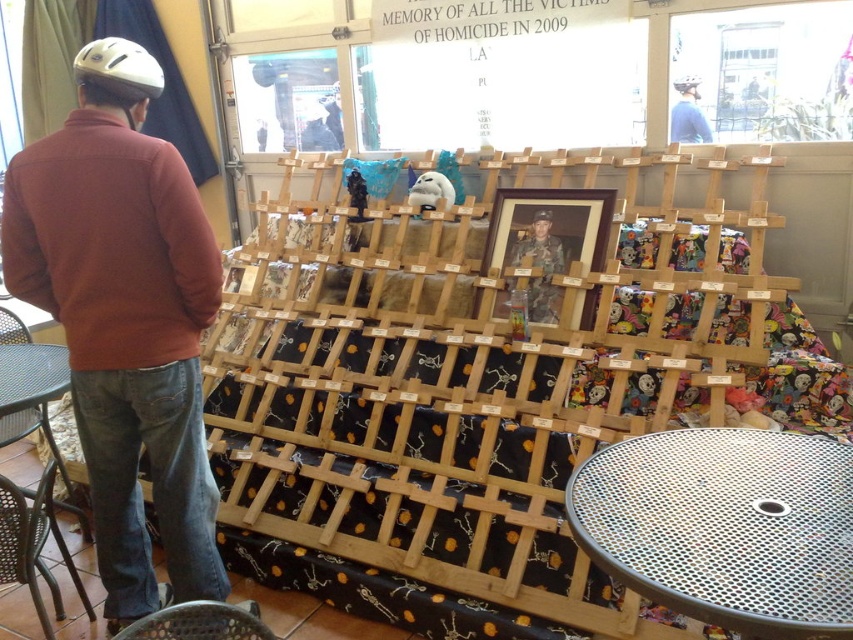
Question: From the image, what is the correct spatial relationship of metal mesh chair at lower left in relation to white matte helmet at upper left?

Choices:
 (A) below
 (B) above

Answer: (A)

Question: In this image, where is metal mesh table at lower left located relative to metal mesh chair at lower left?

Choices:
 (A) above
 (B) below

Answer: (A)

Question: Is brown cotton jacket at left smaller than matte black helmet at upper center?

Choices:
 (A) yes
 (B) no

Answer: (B)

Question: Estimate the real-world distances between objects in this image. Which object is closer to the metal mesh table at lower right?

Choices:
 (A) brown cotton jacket at left
 (B) metal mesh table at lower left
 (C) camouflage uniform at center
 (D) wooden photo frame at center

Answer: (D)

Question: Which point appears closest to the camera in this image?

Choices:
 (A) pyautogui.click(x=120, y=67)
 (B) pyautogui.click(x=173, y=616)

Answer: (B)

Question: Considering the real-world distances, which object is farthest from the metal mesh table at lower left?

Choices:
 (A) metal mesh chair at lower left
 (B) white matte helmet at upper left
 (C) metal mesh table at lower right

Answer: (C)